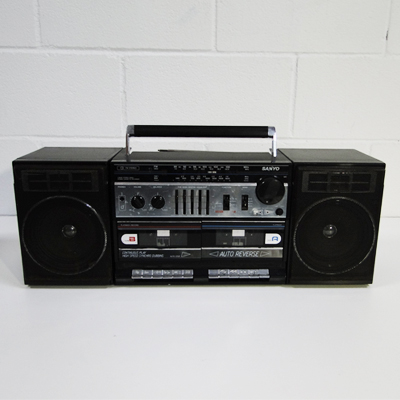
You are a GUI agent. You are given a task and a screenshot of the screen. Output one action in this format:
    pyautogui.click(x=<x>, y=<y>)
    Task: Click on the handle where you pick up the boombox
    The image size is (400, 400).
    Given the screenshot: What is the action you would take?
    pyautogui.click(x=195, y=127)